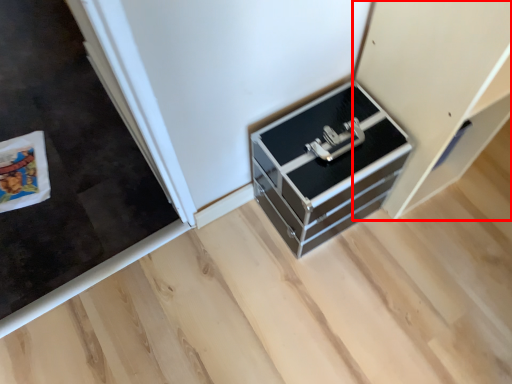
Question: From the image's perspective, what is the correct spatial relationship of cabinetry (annotated by the red box) in relation to chest of drawers?

Choices:
 (A) above
 (B) below

Answer: (A)